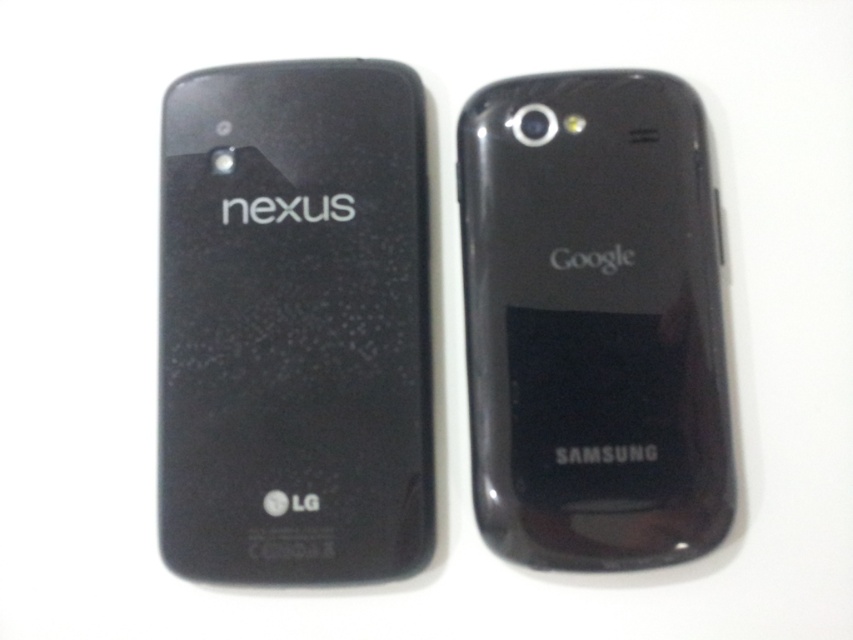
You are an assistant who needs to locate the matte black nexus phone at left in the image. According to the coordinates provided, where exactly is it positioned?

The matte black nexus phone at left is positioned at coordinates point [294,324].

You are a delivery person who needs to place both the matte black nexus phone at left and the glossy black phone at center into a box that can only accommodate items within 8 inches of each other. Will both phones fit in the box without exceeding the space constraint?

The matte black nexus phone at left is 8.16 inches from the glossy black phone at center, which exceeds the 8 inches limit. Therefore, the phones cannot fit into the box without exceeding the space constraint.

You are examining two smartphones placed side by side on a white background. You notice a point at coordinates [294,324]. Which smartphone is located at that point?

The point at [294,324] is occupied by the matte black nexus phone at left.